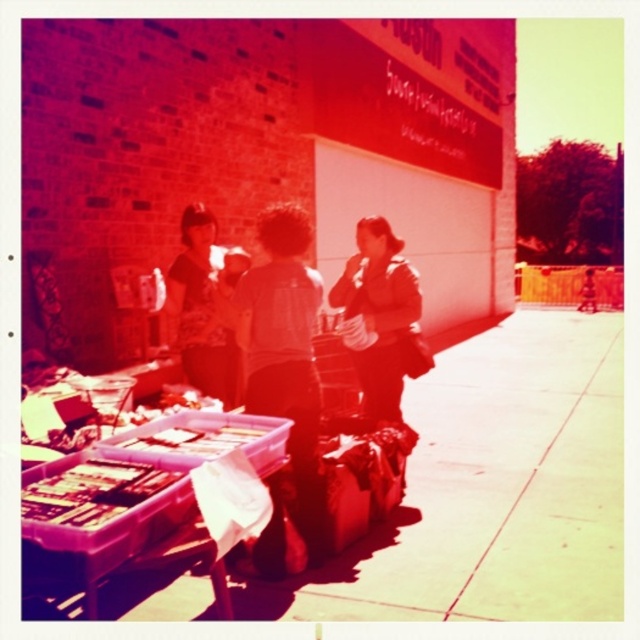
Is point (380, 280) more distant than point (212, 339)?

No, it is in front of (212, 339).

Which of these two, matte brown jacket at center or matte black shirt at center, stands shorter?

Standing shorter between the two is matte brown jacket at center.

Which is in front, point (404, 301) or point (198, 224)?

Point (404, 301)

This screenshot has width=640, height=640. What are the coordinates of `matte brown jacket at center` in the screenshot? It's located at (381, 316).